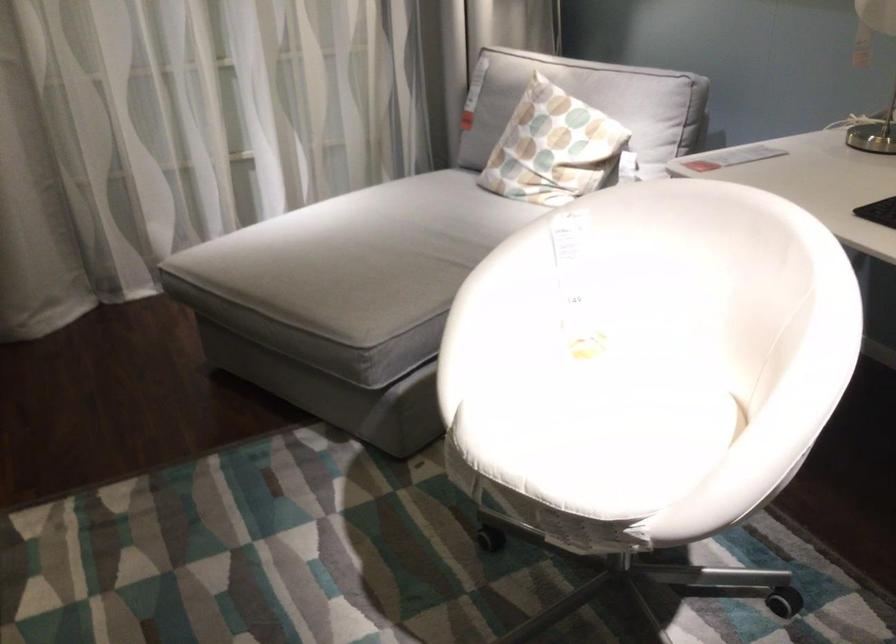
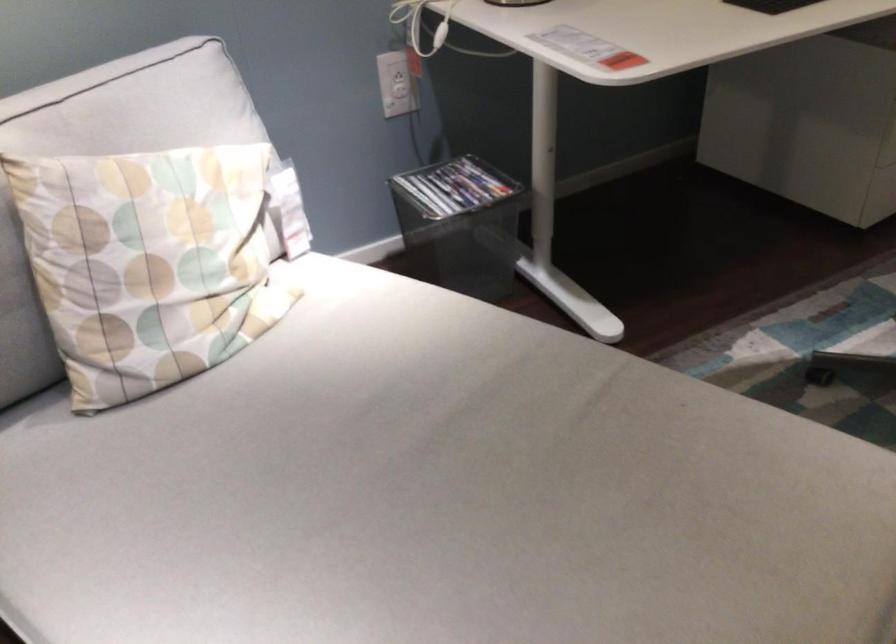
The point at (400, 239) is marked in the first image. Where is the corresponding point in the second image?

(438, 495)